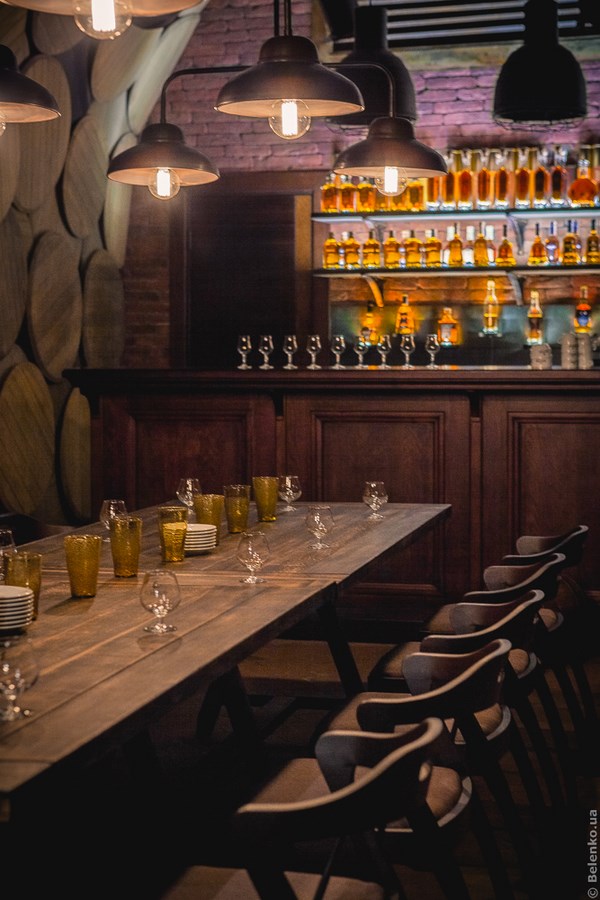
Image resolution: width=600 pixels, height=900 pixels. I want to click on light bulbs, so click(x=95, y=15), click(x=1, y=129), click(x=153, y=182), click(x=283, y=115), click(x=395, y=182).